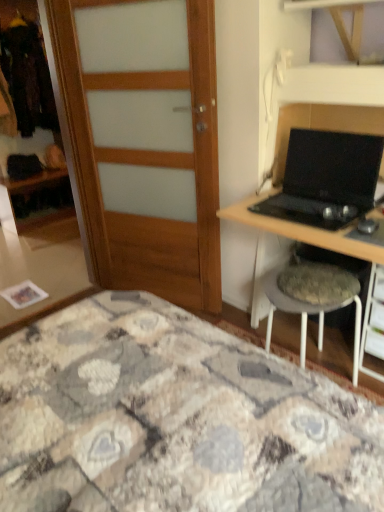
Question: Is the depth of wooden door at left greater than that of black matte laptop at right?

Choices:
 (A) yes
 (B) no

Answer: (A)

Question: From the image's perspective, is wooden door at left located beneath black matte laptop at right?

Choices:
 (A) no
 (B) yes

Answer: (A)

Question: Does wooden door at left have a larger size compared to black matte laptop at right?

Choices:
 (A) no
 (B) yes

Answer: (B)

Question: Is wooden door at left smaller than black matte laptop at right?

Choices:
 (A) yes
 (B) no

Answer: (B)

Question: Does wooden door at left appear on the right side of black matte laptop at right?

Choices:
 (A) no
 (B) yes

Answer: (A)

Question: In terms of size, does textured fabric stool at right appear bigger or smaller than black plastic drawer at lower right?

Choices:
 (A) small
 (B) big

Answer: (B)

Question: Is textured fabric stool at right wider or thinner than black plastic drawer at lower right?

Choices:
 (A) wide
 (B) thin

Answer: (A)

Question: Would you say textured fabric stool at right is to the left or to the right of black plastic drawer at lower right in the picture?

Choices:
 (A) left
 (B) right

Answer: (A)

Question: Considering the positions of point (337, 287) and point (377, 268), is point (337, 287) closer or farther from the camera than point (377, 268)?

Choices:
 (A) farther
 (B) closer

Answer: (B)

Question: Would you say black plastic drawer at lower right is to the left or to the right of matte wood wardrobe at left in the picture?

Choices:
 (A) right
 (B) left

Answer: (A)

Question: From their relative heights in the image, would you say black plastic drawer at lower right is taller or shorter than matte wood wardrobe at left?

Choices:
 (A) short
 (B) tall

Answer: (A)

Question: Is black plastic drawer at lower right inside or outside of matte wood wardrobe at left?

Choices:
 (A) inside
 (B) outside

Answer: (B)

Question: Looking at their shapes, would you say black plastic drawer at lower right is wider or thinner than matte wood wardrobe at left?

Choices:
 (A) wide
 (B) thin

Answer: (A)

Question: Is black plastic mouse at right taller or shorter than matte wood wardrobe at left?

Choices:
 (A) tall
 (B) short

Answer: (B)

Question: In terms of width, does black plastic mouse at right look wider or thinner when compared to matte wood wardrobe at left?

Choices:
 (A) thin
 (B) wide

Answer: (A)